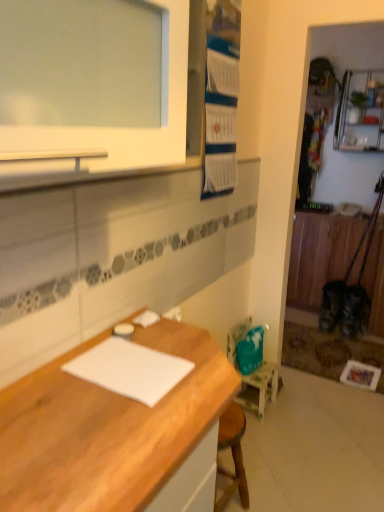
Locate an element on the screen. free location in front of teal fabric chair at lower right is located at coordinates (269, 434).